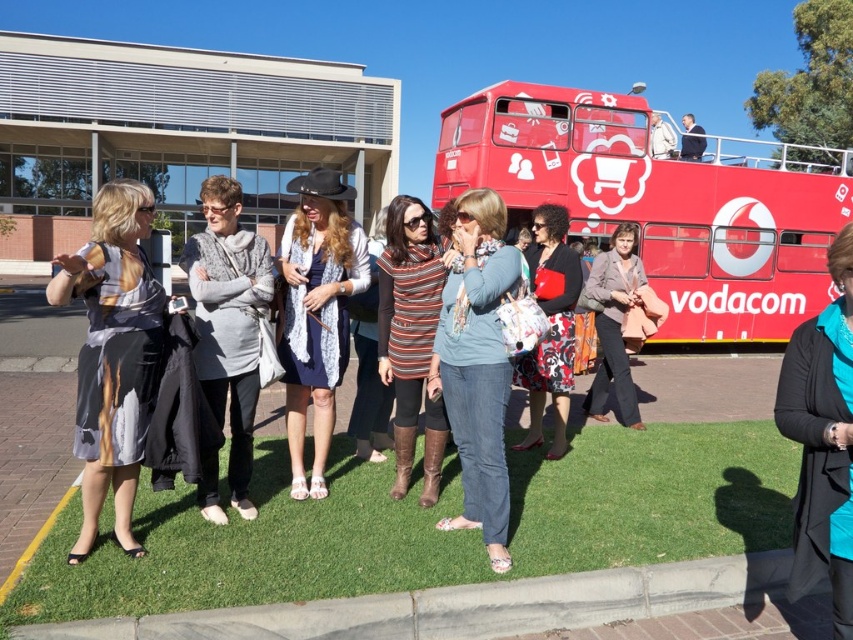
Does denim jeans at center have a smaller size compared to teal satin jacket at center?

No.

Is denim jeans at center thinner than teal satin jacket at center?

In fact, denim jeans at center might be wider than teal satin jacket at center.

The height and width of the screenshot is (640, 853). What do you see at coordinates (479, 364) in the screenshot? I see `denim jeans at center` at bounding box center [479, 364].

Locate an element on the screen. Image resolution: width=853 pixels, height=640 pixels. denim jeans at center is located at coordinates (479, 364).

Does gray wool sweater at center appear over brown leather jacket at center?

No, gray wool sweater at center is not above brown leather jacket at center.

Does gray wool sweater at center appear on the left side of brown leather jacket at center?

Correct, you'll find gray wool sweater at center to the left of brown leather jacket at center.

Who is more forward, (233, 259) or (608, 371)?

Positioned in front is point (233, 259).

This screenshot has height=640, width=853. Find the location of `gray wool sweater at center`. gray wool sweater at center is located at coordinates (229, 321).

Is point (33, 584) positioned in front of point (817, 364)?

No, it is behind (817, 364).

Between green grass at lower center and teal satin jacket at center, which one appears on the right side from the viewer's perspective?

teal satin jacket at center is more to the right.

Between point (230, 563) and point (796, 524), which one is positioned behind?

Point (230, 563)

You are a GUI agent. You are given a task and a screenshot of the screen. Output one action in this format:
    pyautogui.click(x=<x>, y=<y>)
    Task: Click on the green grass at lower center
    This screenshot has width=853, height=640.
    Given the screenshot: What is the action you would take?
    pyautogui.click(x=254, y=550)